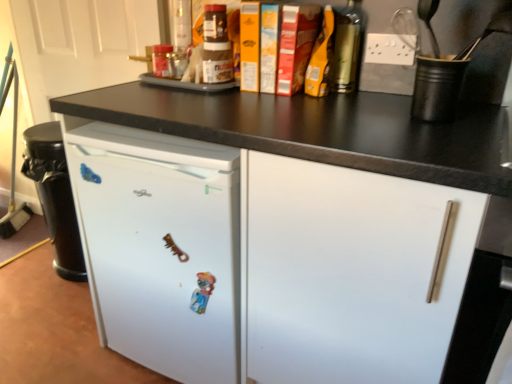
Locate an element on the screen. The width and height of the screenshot is (512, 384). space that is in front of metallic gold bottle at upper right, which is the first bottle from front to back is located at coordinates (367, 104).